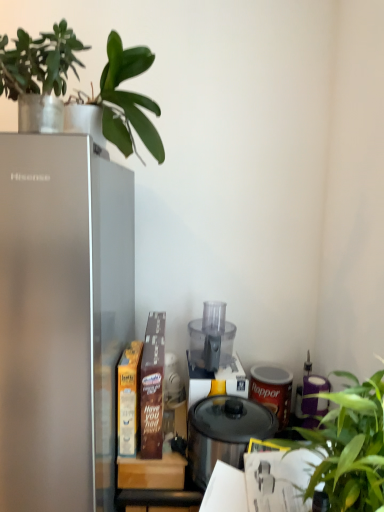
Question: From the image's perspective, does green leafy plant at right, which is the second houseplant from left to right, appear lower than transparent plastic blender at center?

Choices:
 (A) no
 (B) yes

Answer: (B)

Question: Is the depth of green leafy plant at right, marked as the 1th houseplant in a right-to-left arrangement, less than that of transparent plastic blender at center?

Choices:
 (A) no
 (B) yes

Answer: (B)

Question: Is green leafy plant at right, the first houseplant when ordered from bottom to top, positioned with its back to transparent plastic blender at center?

Choices:
 (A) no
 (B) yes

Answer: (A)

Question: Can you confirm if green leafy plant at right, acting as the second houseplant starting from the top, is shorter than transparent plastic blender at center?

Choices:
 (A) no
 (B) yes

Answer: (A)

Question: Considering the relative sizes of green leafy plant at right, acting as the second houseplant starting from the top, and transparent plastic blender at center in the image provided, is green leafy plant at right, acting as the second houseplant starting from the top, taller than transparent plastic blender at center?

Choices:
 (A) no
 (B) yes

Answer: (B)

Question: From the image's perspective, is satin silver refrigerator at left located above or below green matte plant at upper left, which ranks as the first houseplant in left-to-right order?

Choices:
 (A) above
 (B) below

Answer: (B)

Question: Is satin silver refrigerator at left bigger or smaller than green matte plant at upper left, which is the second houseplant in right-to-left order?

Choices:
 (A) big
 (B) small

Answer: (A)

Question: Is satin silver refrigerator at left to the left or to the right of green matte plant at upper left, positioned as the 2th houseplant in bottom-to-top order, in the image?

Choices:
 (A) right
 (B) left

Answer: (B)

Question: In the image, is satin silver refrigerator at left positioned in front of or behind green matte plant at upper left, positioned as the 2th houseplant in bottom-to-top order?

Choices:
 (A) behind
 (B) front

Answer: (B)

Question: Choose the correct answer: Is green leafy plant at right, marked as the 1th houseplant in a right-to-left arrangement, inside satin silver refrigerator at left or outside it?

Choices:
 (A) outside
 (B) inside

Answer: (A)

Question: From the image's perspective, relative to satin silver refrigerator at left, is green leafy plant at right, which is the second houseplant from left to right, above or below?

Choices:
 (A) above
 (B) below

Answer: (B)

Question: In the image, is green leafy plant at right, acting as the second houseplant starting from the top, positioned in front of or behind satin silver refrigerator at left?

Choices:
 (A) front
 (B) behind

Answer: (A)

Question: From a real-world perspective, is green leafy plant at right, acting as the second houseplant starting from the top, physically located above or below satin silver refrigerator at left?

Choices:
 (A) below
 (B) above

Answer: (B)

Question: Is satin silver refrigerator at left in front of or behind transparent plastic blender at center in the image?

Choices:
 (A) front
 (B) behind

Answer: (A)

Question: Considering the relative positions of satin silver refrigerator at left and transparent plastic blender at center in the image provided, is satin silver refrigerator at left to the left or to the right of transparent plastic blender at center?

Choices:
 (A) right
 (B) left

Answer: (B)